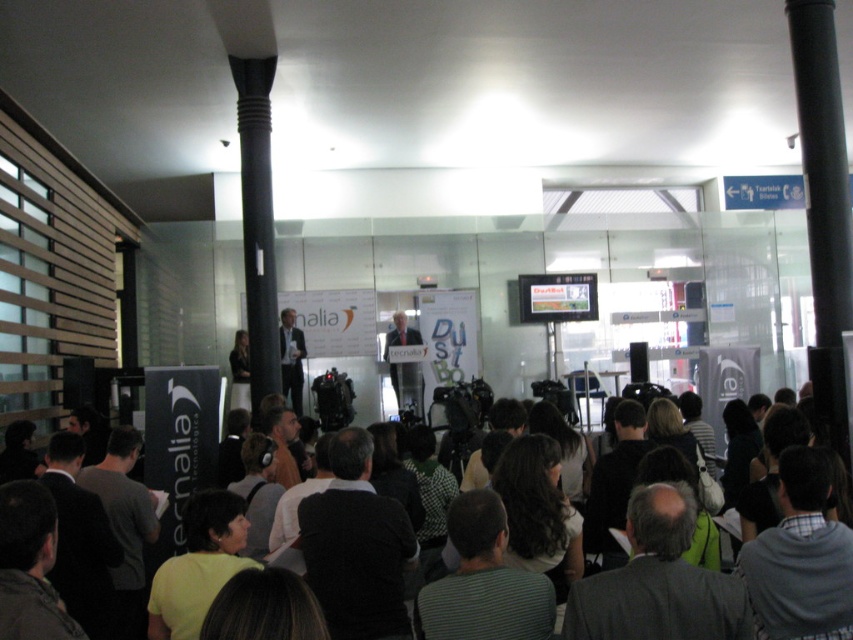
You are attending a conference and want to take a photo of the two points on the stage. The first point is at coordinates point (x=399, y=324) and the second is at point (x=305, y=349). Which point will appear closer to you in the photo?

Point (x=305, y=349) will appear closer to you in the photo because it is closer to the camera than point (x=399, y=324).

You are a photographer at the event and need to capture a closeup of the matte black suit at center. The camera you are using has a focal length of 50mm. What is the minimum distance you need to be from the subject to achieve a sharp focus?

The position of matte black suit at center is at point (403, 364), so the minimum distance required would depend on the camera sensor size and aperture, which are not provided in the scene description. Without additional information about the camera specifications, it is impossible to calculate the exact distance needed for sharp focus.

You are at the event and want to find the dark gray clothing at center. Can you describe the location of the point with coordinates (799, 547) relative to the dark gray clothing?

The point with coordinates (799, 547) is located on the dark gray clothing at center.